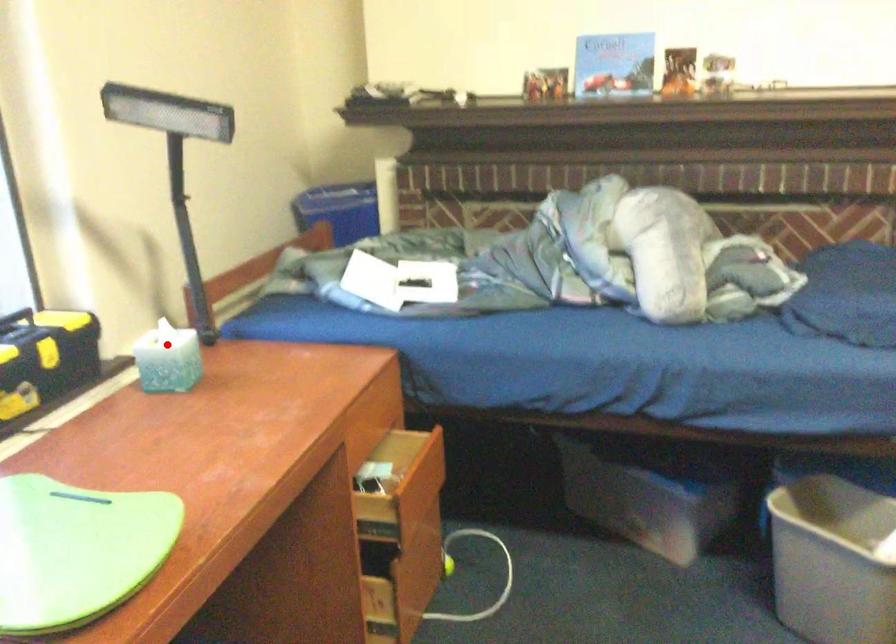
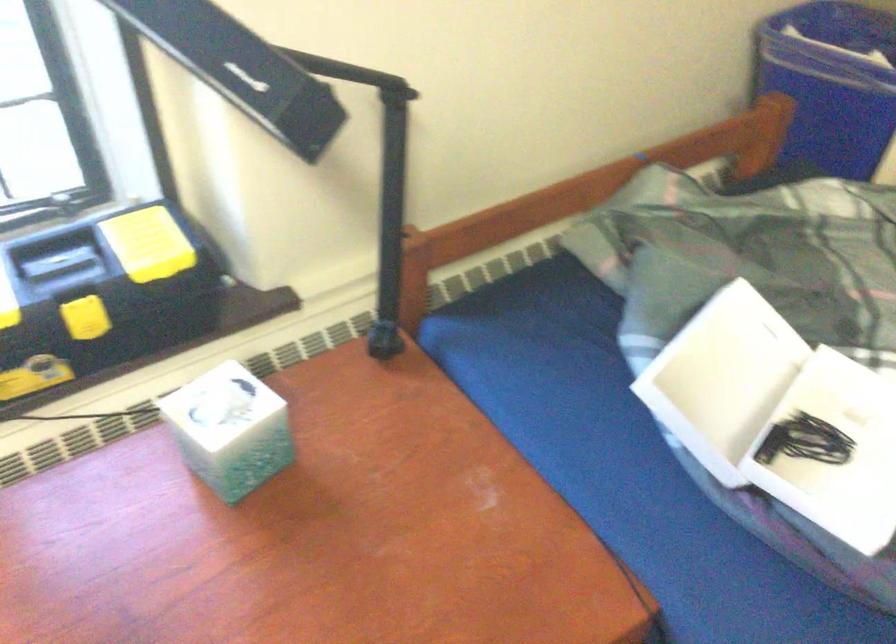
Question: I am providing you with two images of the same scene from different viewpoints. Given a red point in image1, look at the same physical point in image2. Is it:

Choices:
 (A) Closer to the viewpoint
 (B) Farther from the viewpoint

Answer: (A)